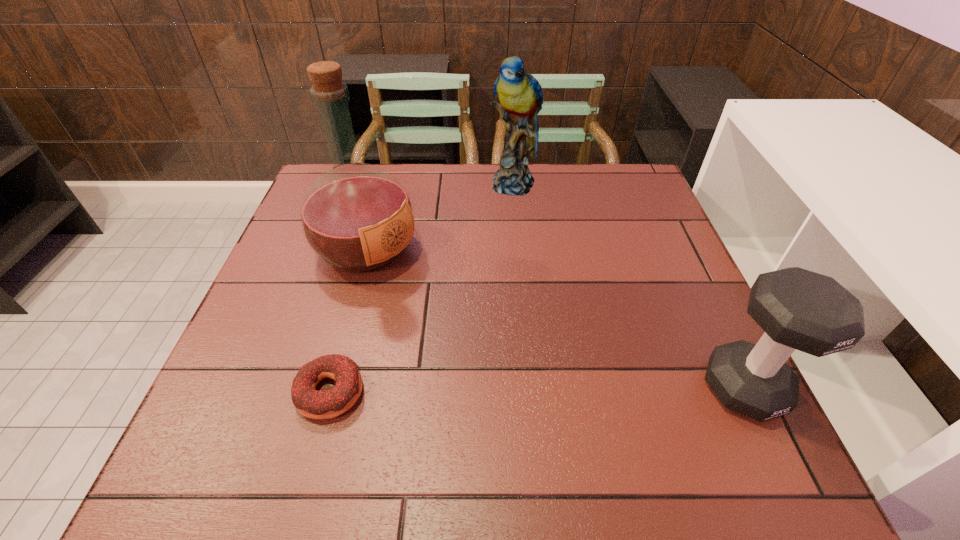
Identify the location of free space located 0.260m on the front label of the liquor. This screenshot has height=540, width=960. (490, 326).

Find the location of `free region located on the face of the second tallest object`. free region located on the face of the second tallest object is located at coordinates (516, 226).

Locate an element on the screen. The height and width of the screenshot is (540, 960). vacant space situated on the face of the second tallest object is located at coordinates (516, 217).

What are the coordinates of `vacant point located on the face of the second tallest object` in the screenshot? It's located at click(516, 219).

What are the coordinates of `object positioned at the far edge` in the screenshot? It's located at (519, 95).

At what (x,y) coordinates should I click in order to perform the action: click on doughnut that is at the near edge. Please return your answer as a coordinate pair (x, y). This screenshot has width=960, height=540. Looking at the image, I should click on (311, 403).

Find the location of a particular element. dumbbell that is at the near edge is located at coordinates (798, 309).

At what (x,y) coordinates should I click in order to perform the action: click on doughnut at the left edge. Please return your answer as a coordinate pair (x, y). The width and height of the screenshot is (960, 540). Looking at the image, I should click on (311, 403).

You are a GUI agent. You are given a task and a screenshot of the screen. Output one action in this format:
    pyautogui.click(x=<x>, y=<y>)
    Task: Click on the liquor that is positioned at the left edge
    The height and width of the screenshot is (540, 960).
    Given the screenshot: What is the action you would take?
    pyautogui.click(x=356, y=217)

Where is `object at the right edge`? object at the right edge is located at coordinates (798, 309).